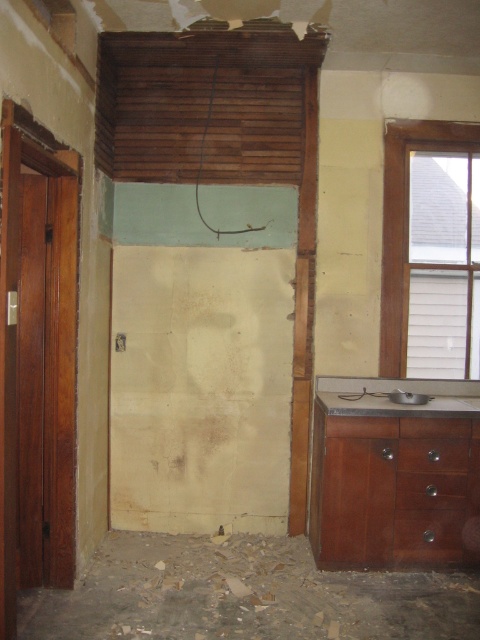
Question: Which object is closer to the camera taking this photo?

Choices:
 (A) brown wood dresser at lower right
 (B) clear glass window at upper right

Answer: (A)

Question: Can you confirm if clear glass window at upper right is positioned above satin silver sink at lower right?

Choices:
 (A) yes
 (B) no

Answer: (A)

Question: Which of these objects is positioned farthest from the brown wooden drawer at lower right?

Choices:
 (A) satin silver sink at lower right
 (B) brown wood dresser at lower right
 (C) clear glass window at upper right

Answer: (C)

Question: Does brown wooden drawer at lower right have a greater width compared to satin silver sink at lower right?

Choices:
 (A) yes
 (B) no

Answer: (A)

Question: Which point is farther to the camera?

Choices:
 (A) brown wooden drawer at lower right
 (B) brown wood dresser at lower right
 (C) satin silver sink at lower right

Answer: (C)

Question: Is clear glass window at upper right above brown wooden drawer at lower right?

Choices:
 (A) no
 (B) yes

Answer: (B)